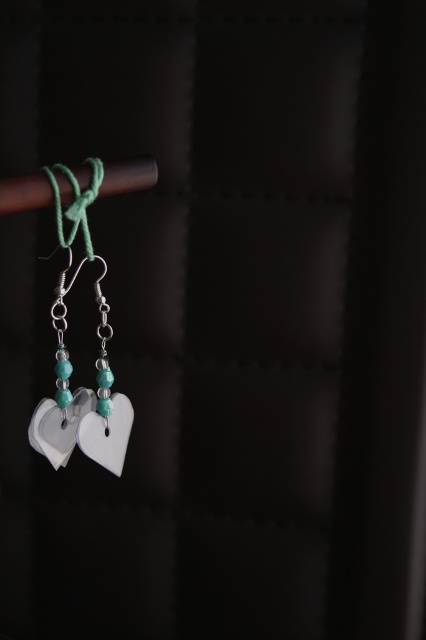
Can you confirm if white plastic heart-shaped pendants at left is positioned to the right of green thread at upper left?

Correct, you'll find white plastic heart-shaped pendants at left to the right of green thread at upper left.

Where is `white plastic heart-shaped pendants at left`? This screenshot has height=640, width=426. white plastic heart-shaped pendants at left is located at coordinates (71, 362).

This screenshot has width=426, height=640. I want to click on white plastic heart-shaped pendants at left, so click(71, 362).